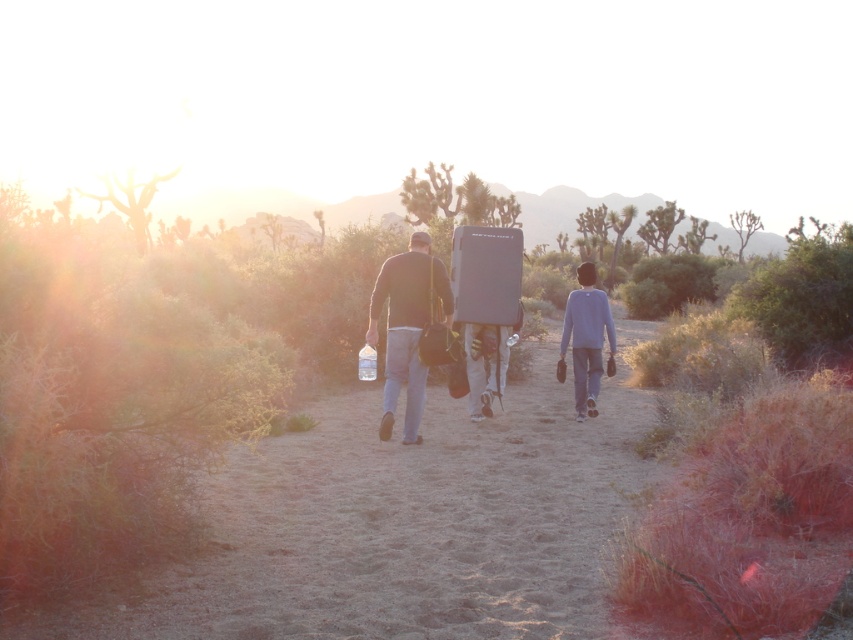
Question: Does matte black surfboard at center have a smaller size compared to gray cotton shirt at center?

Choices:
 (A) yes
 (B) no

Answer: (B)

Question: Does brown sand at center have a smaller size compared to matte black surfboard at center?

Choices:
 (A) yes
 (B) no

Answer: (B)

Question: Among these objects, which one is farthest from the camera?

Choices:
 (A) brown sand at center
 (B) gray cotton shirt at center

Answer: (B)

Question: Does matte black backpack at center appear under gray cotton shirt at center?

Choices:
 (A) yes
 (B) no

Answer: (B)

Question: Which object is the farthest from the matte black surfboard at center?

Choices:
 (A) gray cotton shirt at center
 (B) matte black backpack at center

Answer: (A)

Question: Which point appears closest to the camera in this image?

Choices:
 (A) (502, 266)
 (B) (531, 429)

Answer: (B)